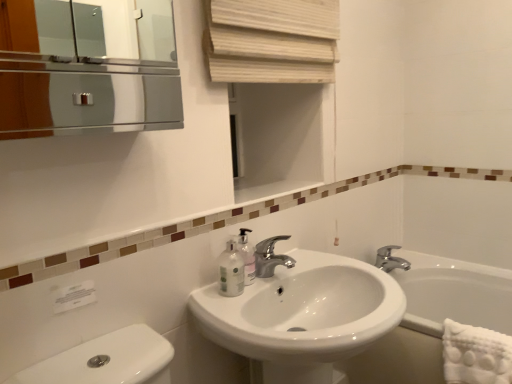
Question: Considering the positions of point (452, 357) and point (251, 253), is point (452, 357) closer or farther from the camera than point (251, 253)?

Choices:
 (A) farther
 (B) closer

Answer: (A)

Question: From the image's perspective, is white textured towel at lower right positioned above or below translucent plastic soap dispenser at sink?

Choices:
 (A) above
 (B) below

Answer: (B)

Question: Estimate the real-world distances between objects in this image. Which object is closer to the white glossy sink at center?

Choices:
 (A) translucent plastic mouthwash at lower center
 (B) polished chrome faucet at center, which is the second tap from back to front
 (C) white ceramic bathtub at lower right
 (D) translucent plastic soap dispenser at sink
 (E) natural wood blinds at upper center

Answer: (B)

Question: Which is farther from the silver metallic faucet at center, positioned as the 1th tap in right-to-left order?

Choices:
 (A) white ceramic bathtub at lower right
 (B) white textured towel at lower right
 (C) translucent plastic mouthwash at lower center
 (D) white glossy sink at center
 (E) polished chrome faucet at center, the 1th tap from the front

Answer: (C)